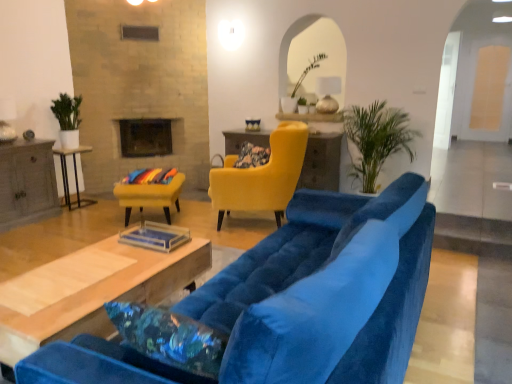
Question: Which direction should I rotate to look at matte yellow armchair at center, the 1th chair positioned from the right, — up or down?

Choices:
 (A) down
 (B) up

Answer: (B)

Question: Is wooden coffee table at center, arranged as the first table when viewed from the front, further to the viewer compared to white glossy side table at left, arranged as the 2th table when viewed from the back?

Choices:
 (A) yes
 (B) no

Answer: (B)

Question: Is wooden coffee table at center, the 3th table positioned from the left, looking in the opposite direction of white glossy side table at left, acting as the third table starting from the front?

Choices:
 (A) no
 (B) yes

Answer: (A)

Question: Does wooden coffee table at center, the 3th table positioned from the left, appear on the right side of white glossy side table at left, acting as the third table starting from the front?

Choices:
 (A) no
 (B) yes

Answer: (B)

Question: From the image's perspective, would you say wooden coffee table at center, marked as the second table in a right-to-left arrangement, is positioned over white glossy side table at left, the 3th table when ordered from right to left?

Choices:
 (A) yes
 (B) no

Answer: (B)

Question: Considering the relative positions of wooden coffee table at center, arranged as the first table when viewed from the front, and white glossy side table at left, acting as the third table starting from the front, in the image provided, is wooden coffee table at center, arranged as the first table when viewed from the front, to the left of white glossy side table at left, acting as the third table starting from the front, from the viewer's perspective?

Choices:
 (A) yes
 (B) no

Answer: (B)

Question: From a real-world perspective, is wooden coffee table at center, the 3th table positioned from the left, physically above white glossy side table at left, arranged as the 2th table when viewed from the back?

Choices:
 (A) no
 (B) yes

Answer: (A)

Question: Does gray wood side table at left, which is counted as the first table, starting from the left, have a larger size compared to green leafy plant at right?

Choices:
 (A) no
 (B) yes

Answer: (A)

Question: Considering the relative sizes of gray wood side table at left, marked as the third table in a back-to-front arrangement, and green leafy plant at right in the image provided, is gray wood side table at left, marked as the third table in a back-to-front arrangement, taller than green leafy plant at right?

Choices:
 (A) no
 (B) yes

Answer: (A)

Question: From the image's perspective, is gray wood side table at left, which is counted as the first table, starting from the left, on top of green leafy plant at right?

Choices:
 (A) no
 (B) yes

Answer: (A)

Question: Is gray wood side table at left, which ranks as the fourth table in right-to-left order, not inside green leafy plant at right?

Choices:
 (A) yes
 (B) no

Answer: (A)

Question: From a real-world perspective, is gray wood side table at left, marked as the third table in a back-to-front arrangement, over green leafy plant at right?

Choices:
 (A) no
 (B) yes

Answer: (A)

Question: Does gray wood side table at left, which is the 2th table from front to back, have a smaller size compared to green leafy plant at right?

Choices:
 (A) no
 (B) yes

Answer: (B)

Question: From a real-world perspective, is matte yellow armchair at center, the 1th chair positioned from the right, below black glass fireplace at upper center?

Choices:
 (A) yes
 (B) no

Answer: (A)